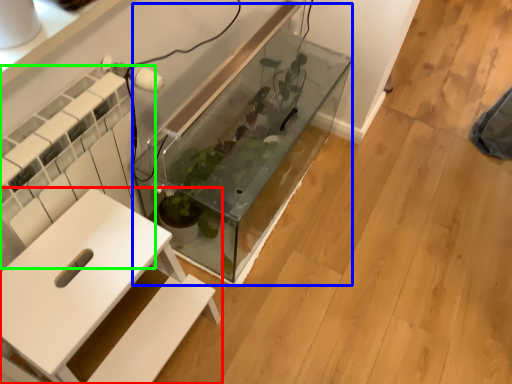
Question: Which object is the closest to the furniture (highlighted by a red box)? Choose among these: glass box (highlighted by a blue box) or radiator (highlighted by a green box).

Choices:
 (A) glass box
 (B) radiator

Answer: (B)